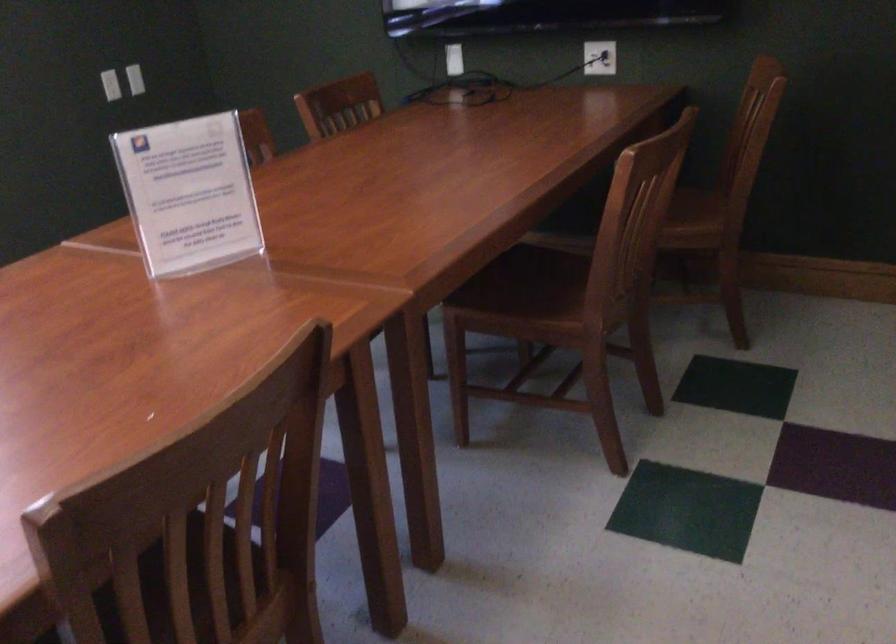
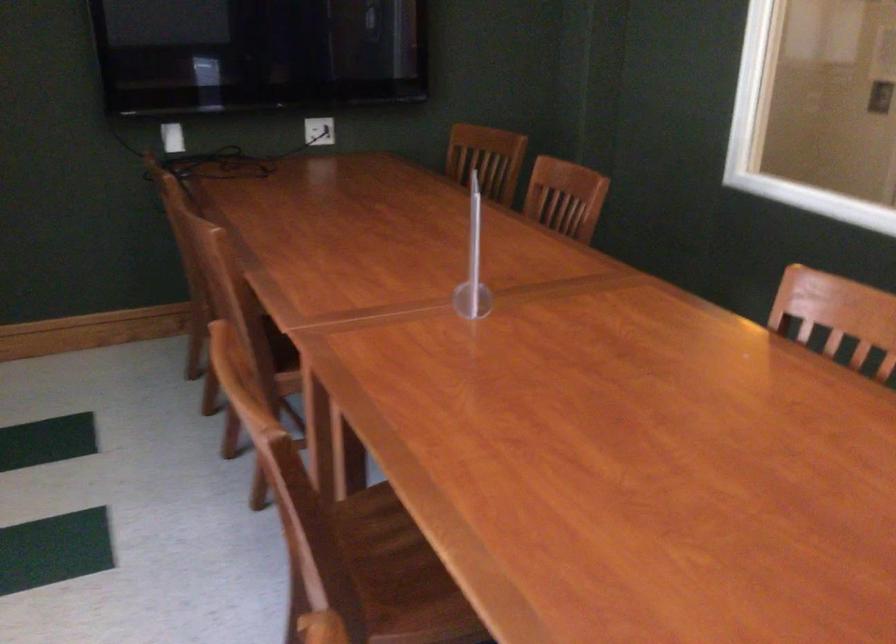
The point at (348, 231) is marked in the first image. Where is the corresponding point in the second image?

(472, 263)